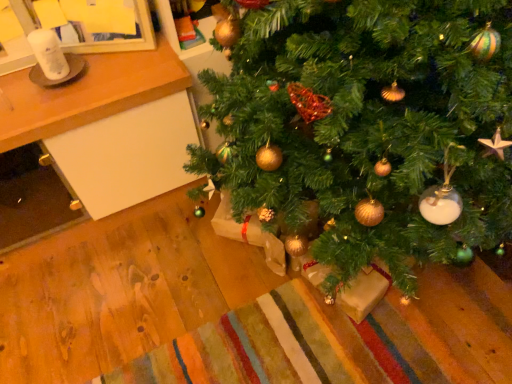
Question: Can you confirm if green matte christmas tree at center is smaller than wooden table at lower left?

Choices:
 (A) yes
 (B) no

Answer: (B)

Question: Is green matte christmas tree at center at the left side of wooden table at lower left?

Choices:
 (A) no
 (B) yes

Answer: (A)

Question: Is green matte christmas tree at center positioned beyond the bounds of wooden table at lower left?

Choices:
 (A) yes
 (B) no

Answer: (A)

Question: Is green matte christmas tree at center further to the viewer compared to wooden table at lower left?

Choices:
 (A) no
 (B) yes

Answer: (A)

Question: Is green matte christmas tree at center directly adjacent to wooden table at lower left?

Choices:
 (A) yes
 (B) no

Answer: (B)

Question: From a real-world perspective, is green matte christmas tree at center positioned over wooden table at lower left based on gravity?

Choices:
 (A) yes
 (B) no

Answer: (A)

Question: Can you confirm if wooden table at lower left is positioned to the left of green matte christmas tree at center?

Choices:
 (A) yes
 (B) no

Answer: (A)

Question: Considering the relative sizes of wooden table at lower left and green matte christmas tree at center in the image provided, is wooden table at lower left smaller than green matte christmas tree at center?

Choices:
 (A) yes
 (B) no

Answer: (A)

Question: From the image's perspective, would you say wooden table at lower left is positioned over green matte christmas tree at center?

Choices:
 (A) no
 (B) yes

Answer: (A)

Question: From a real-world perspective, is wooden table at lower left physically above green matte christmas tree at center?

Choices:
 (A) no
 (B) yes

Answer: (A)

Question: Is wooden table at lower left at the right side of green matte christmas tree at center?

Choices:
 (A) no
 (B) yes

Answer: (A)

Question: Does wooden table at lower left have a lesser height compared to green matte christmas tree at center?

Choices:
 (A) yes
 (B) no

Answer: (A)

Question: From a real-world perspective, is wooden table at lower left positioned above or below green matte christmas tree at center?

Choices:
 (A) above
 (B) below

Answer: (B)